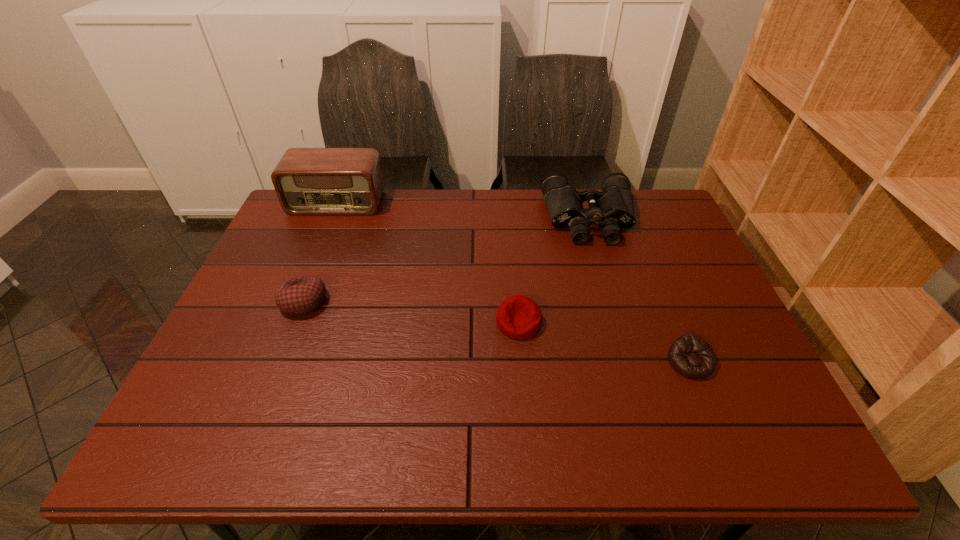
I want to click on radio receiver, so click(308, 181).

Locate an element on the screen. The image size is (960, 540). binoculars is located at coordinates (613, 208).

This screenshot has width=960, height=540. I want to click on the leftmost beanbag, so click(300, 295).

At what (x,y) coordinates should I click in order to perform the action: click on the second beanbag from right to left. Please return your answer as a coordinate pair (x, y). This screenshot has width=960, height=540. Looking at the image, I should click on [x=519, y=317].

Locate an element on the screen. the shortest object is located at coordinates (689, 355).

The width and height of the screenshot is (960, 540). In order to click on the rightmost beanbag in this screenshot , I will do `click(689, 355)`.

Locate an element on the screen. The width and height of the screenshot is (960, 540). vacant position located 0.220m on the front panel of the tallest object is located at coordinates (313, 261).

The width and height of the screenshot is (960, 540). I want to click on vacant space located through the eyepieces of the second tallest object, so click(604, 269).

Locate an element on the screen. vacant space located on the right of the leftmost beanbag is located at coordinates (419, 301).

Find the location of a particular element. blank area located on the seat area of the third object from right to left is located at coordinates (526, 412).